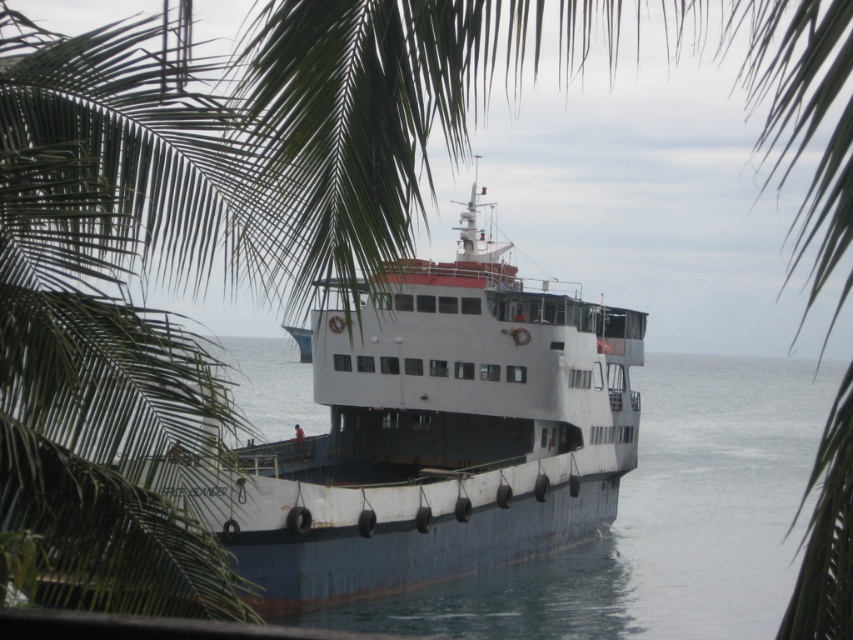
Question: Can you confirm if white matte boat at center is positioned to the right of white matte water at center?

Choices:
 (A) no
 (B) yes

Answer: (B)

Question: Which point is farther to the camera?

Choices:
 (A) white matte boat at center
 (B) white matte water at center

Answer: (A)

Question: Considering the relative positions of white matte boat at center and white matte water at center in the image provided, where is white matte boat at center located with respect to white matte water at center?

Choices:
 (A) above
 (B) below

Answer: (A)

Question: Which point is farther from the camera taking this photo?

Choices:
 (A) (352, 333)
 (B) (822, 385)

Answer: (B)

Question: Does white matte boat at center appear on the right side of white matte water at center?

Choices:
 (A) no
 (B) yes

Answer: (B)